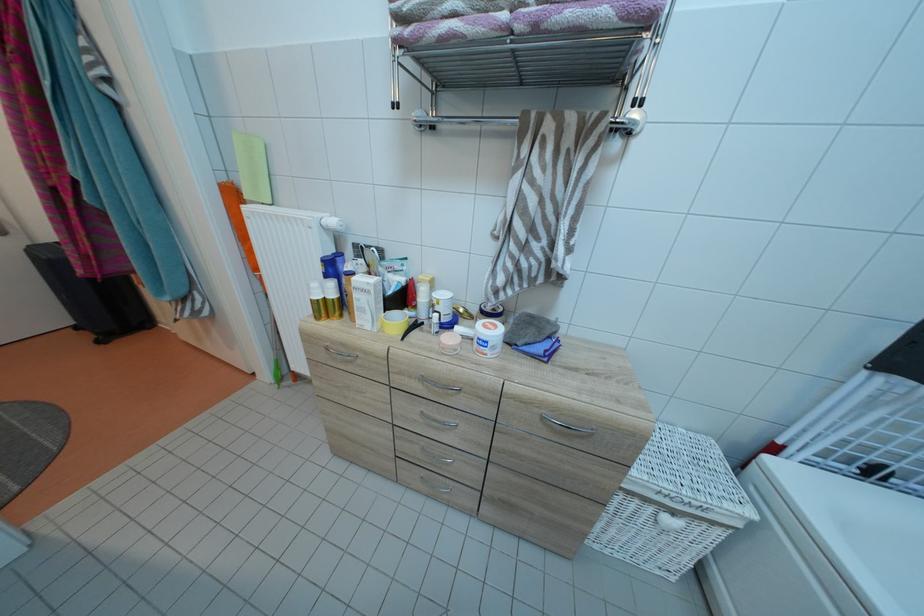
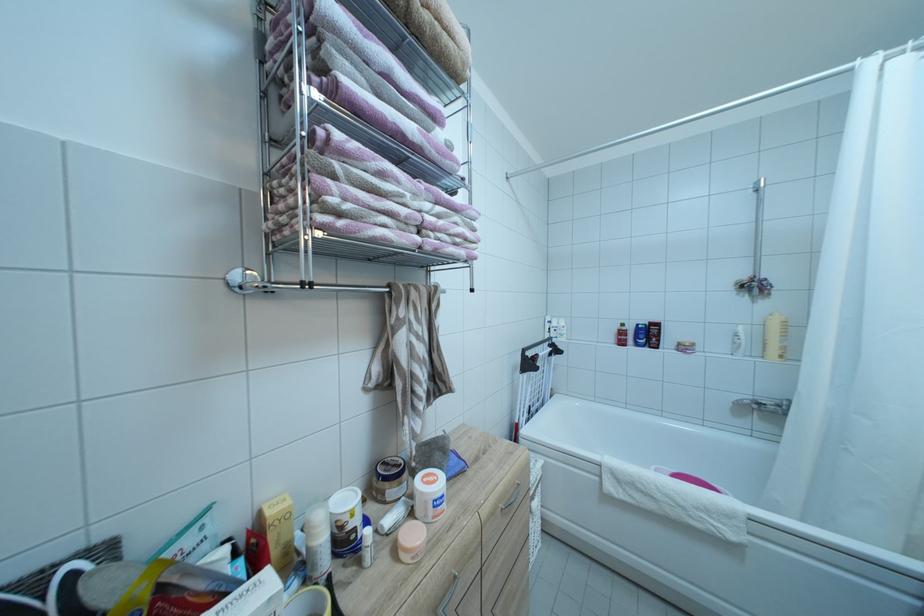
The point at (496, 334) is marked in the first image. Where is the corresponding point in the second image?

(442, 487)